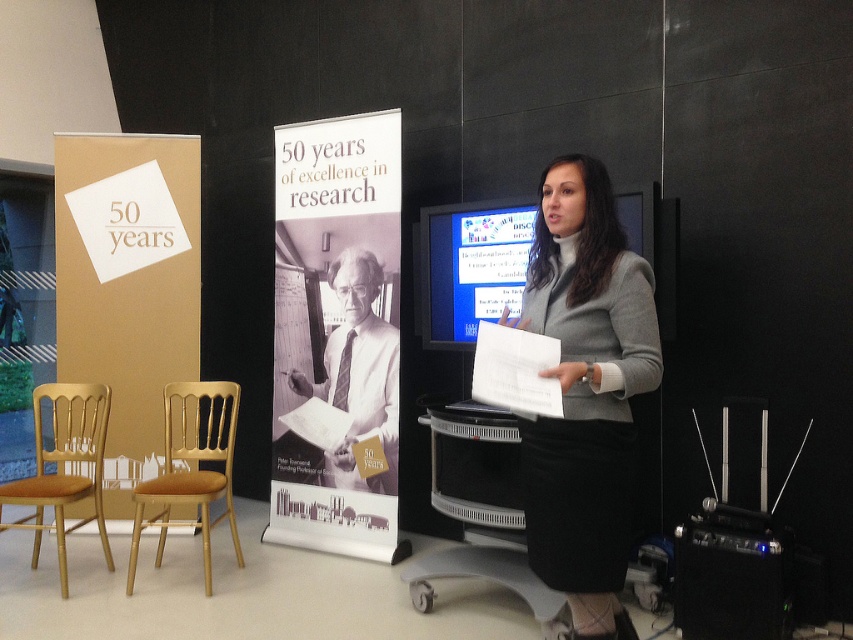
Does matte gold poster at left have a smaller size compared to black plastic speaker at lower right?

Actually, matte gold poster at left might be larger than black plastic speaker at lower right.

Is matte gold poster at left above black plastic speaker at lower right?

Indeed, matte gold poster at left is positioned over black plastic speaker at lower right.

Is point (165, 273) positioned behind point (717, 620)?

Yes, point (165, 273) is behind point (717, 620).

You are a GUI agent. You are given a task and a screenshot of the screen. Output one action in this format:
    pyautogui.click(x=<x>, y=<y>)
    Task: Click on the matte gold poster at left
    
    Given the screenshot: What is the action you would take?
    tap(126, 282)

Which is behind, point (312, 525) or point (146, 164)?

The point (146, 164) is more distant.

Does point (308, 369) come farther from viewer compared to point (198, 292)?

No, it is not.

Who is more distant from viewer, (364, 336) or (125, 301)?

The point (125, 301) is behind.

Where is `black and white banner at center`? black and white banner at center is located at coordinates (335, 330).

Is matte gold poster at left further to the viewer compared to gold wood chair at left?

That is True.

Is matte gold poster at left thinner than gold wood chair at left?

No, matte gold poster at left is not thinner than gold wood chair at left.

Does point (109, 500) come in front of point (38, 385)?

Yes, it is in front of point (38, 385).

Locate an element on the screen. The height and width of the screenshot is (640, 853). matte gold poster at left is located at coordinates tap(126, 282).